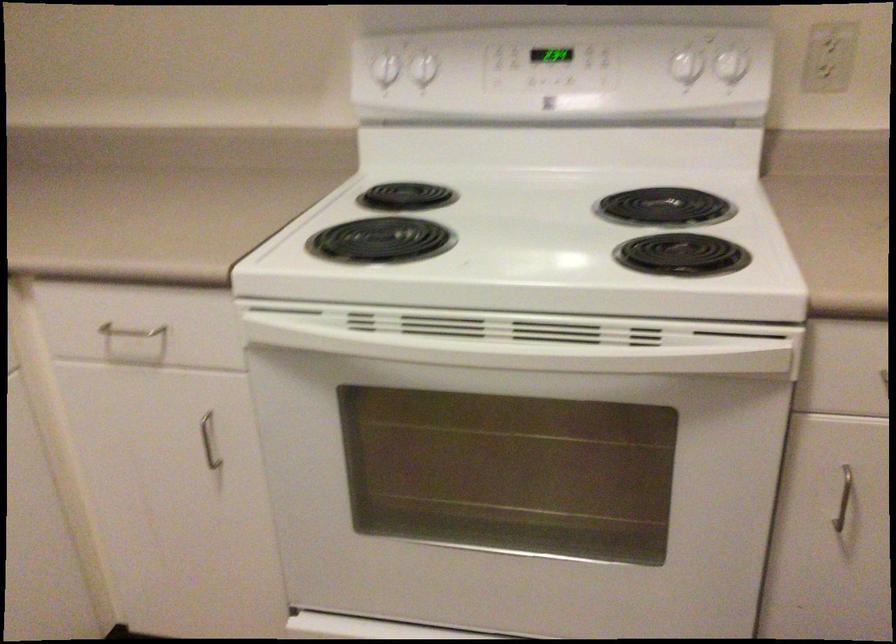
Find where to pull the white oven handle. Please return your answer as a coordinate pair (x, y).

(526, 339)